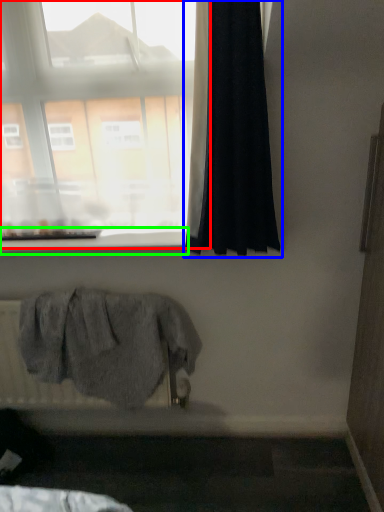
Question: Which object is the closest to the window (highlighted by a red box)? Choose among these: curtain (highlighted by a blue box) or window sill (highlighted by a green box).

Choices:
 (A) curtain
 (B) window sill

Answer: (A)